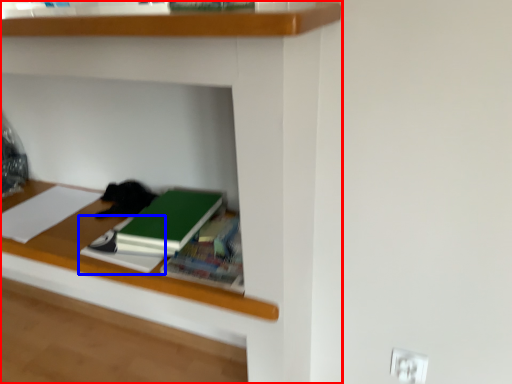
Question: Which of the following is the farthest to the observer, shelf (highlighted by a red box) or notebook (highlighted by a blue box)?

Choices:
 (A) shelf
 (B) notebook

Answer: (B)